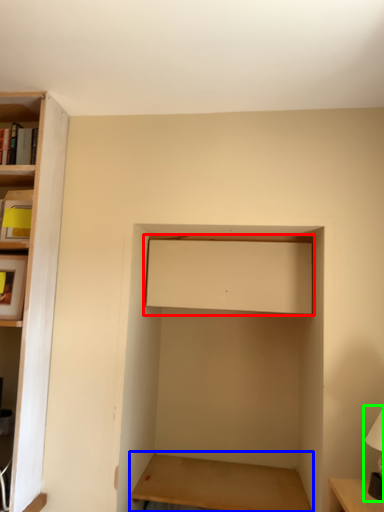
Question: Which object is positioned farthest from cabinet (highlighted by a red box)? Select from table (highlighted by a blue box) and table lamp (highlighted by a green box).

Choices:
 (A) table
 (B) table lamp

Answer: (A)